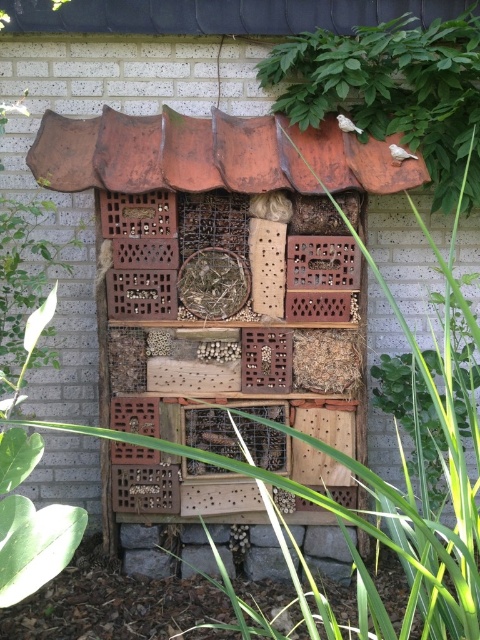
You are a gardener who wants to water the green leafy plant at upper right and the wooden birdhouse at center. The watering can you have can spray water up to 20 inches. Do you think you can water both plants without moving the watering can?

The green leafy plant at upper right is 19.94 inches from the wooden birdhouse at center. Since the watering can can spray up to 20 inches, you can water both the green leafy plant at upper right and the wooden birdhouse at center without moving the watering can, as the distance between them is within the spray range.